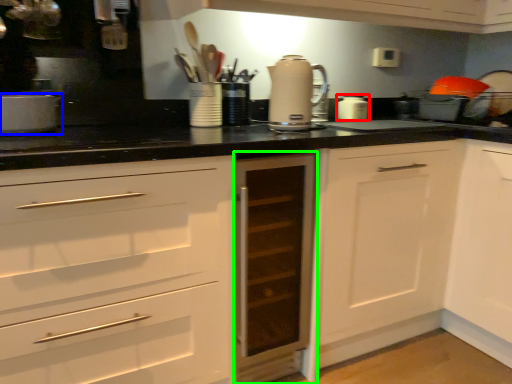
Question: Which object is positioned farthest from kitchen appliance (highlighted by a red box)? Select from kitchen appliance (highlighted by a blue box) and cabinetry (highlighted by a green box).

Choices:
 (A) kitchen appliance
 (B) cabinetry

Answer: (A)